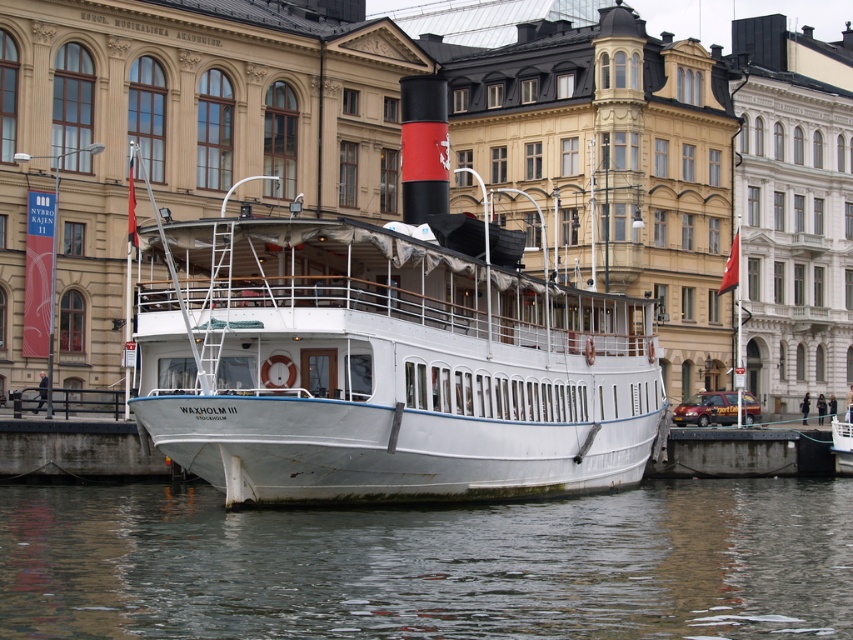
Is smooth gray water at lower center to the left of concrete at lower center from the viewer's perspective?

Indeed, smooth gray water at lower center is positioned on the left side of concrete at lower center.

The width and height of the screenshot is (853, 640). What are the coordinates of `smooth gray water at lower center` in the screenshot? It's located at (430, 564).

Locate an element on the screen. The image size is (853, 640). smooth gray water at lower center is located at coordinates (430, 564).

Is white matte boat at center positioned behind concrete at lower center?

No.

Is white matte boat at center to the right of concrete at lower center from the viewer's perspective?

Incorrect, white matte boat at center is not on the right side of concrete at lower center.

Who is more forward, [239,362] or [819,449]?

Positioned in front is point [239,362].

Locate an element on the screen. The image size is (853, 640). white matte boat at center is located at coordinates (392, 355).

Does white matte boat at center appear on the left side of smooth gray water at lower center?

Yes, white matte boat at center is to the left of smooth gray water at lower center.

Can you confirm if white matte boat at center is taller than smooth gray water at lower center?

A: Indeed, white matte boat at center has a greater height compared to smooth gray water at lower center.

What are the coordinates of `white matte boat at center` in the screenshot? It's located at (392, 355).